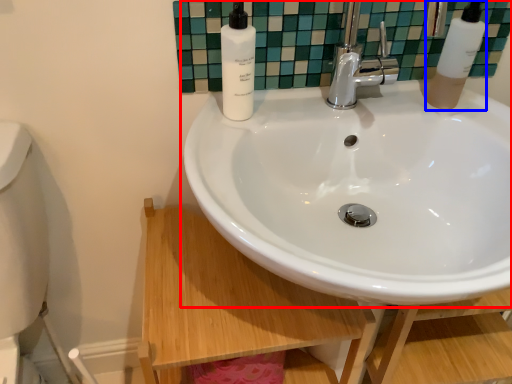
Question: Among these objects, which one is farthest to the camera, sink (highlighted by a red box) or soap dispenser (highlighted by a blue box)?

Choices:
 (A) sink
 (B) soap dispenser

Answer: (B)